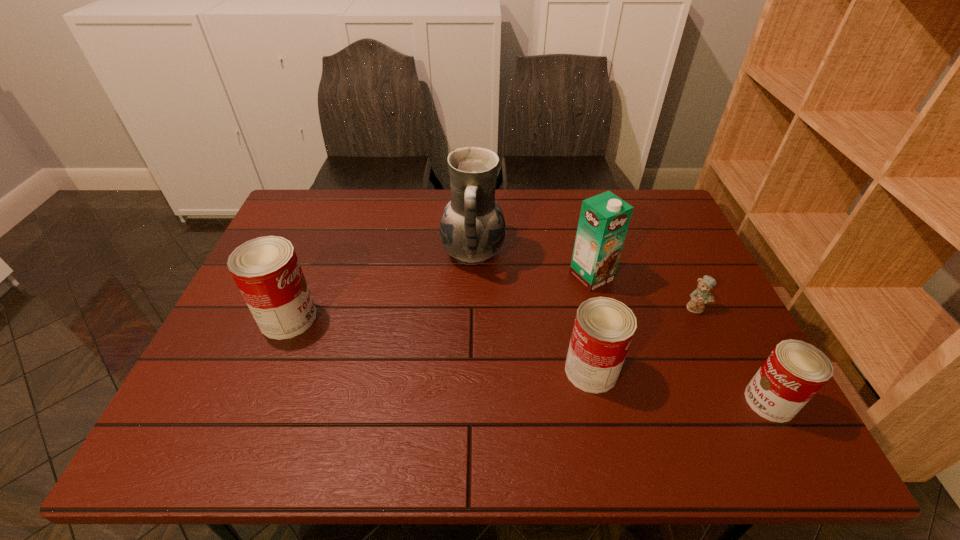
Identify which object is the third nearest to the shortest object. Please provide its 2D coordinates. Your answer should be formatted as a tuple, i.e. [(x, y)], where the tuple contains the x and y coordinates of a point satisfying the conditions above.

[(603, 330)]

At what (x,y) coordinates should I click in order to perform the action: click on can that is the nearest to the rightmost can. Please return your answer as a coordinate pair (x, y). This screenshot has height=540, width=960. Looking at the image, I should click on 603,330.

Locate an element on the screen. can that can be found as the second closest to the fifth shortest object is located at coordinates (795, 371).